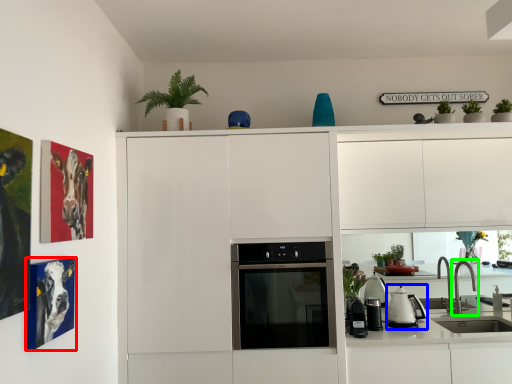
Question: Which is farther away from picture frame (highlighted by a red box)? kitchen appliance (highlighted by a blue box) or tap (highlighted by a green box)?

Choices:
 (A) kitchen appliance
 (B) tap

Answer: (B)